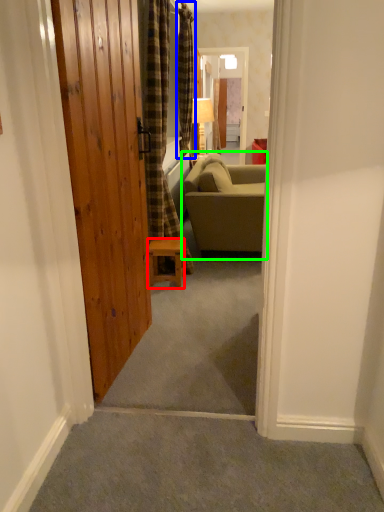
Question: Based on their relative distances, which object is nearer to furniture (highlighted by a red box)? Choose from curtain (highlighted by a blue box) and studio couch (highlighted by a green box).

Choices:
 (A) curtain
 (B) studio couch

Answer: (B)